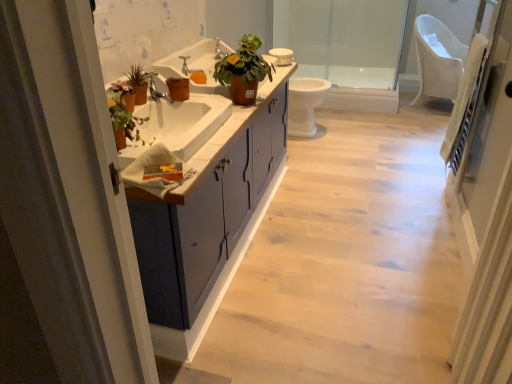
Locate an element on the screen. vacant point to the left of white textured screen door at right is located at coordinates (338, 356).